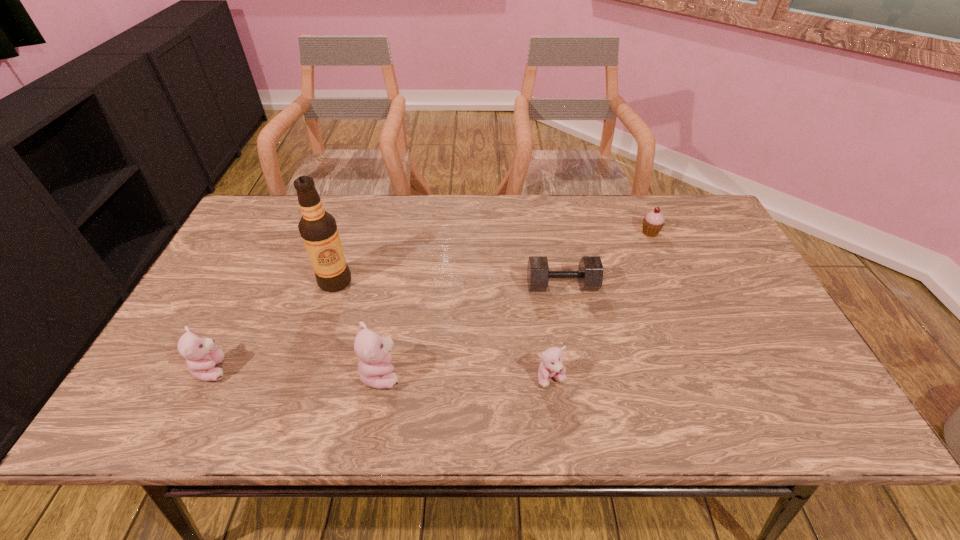
Identify the location of vacant area that lies between the dumbbell and the leftmost teddy bear. (388, 327).

Find the location of `free point between the leftmost teddy bear and the rightmost object`. free point between the leftmost teddy bear and the rightmost object is located at coordinates (432, 301).

Where is `the fourth closest object to the alcohol`? Image resolution: width=960 pixels, height=540 pixels. the fourth closest object to the alcohol is located at coordinates (551, 366).

Locate which object ranks fourth in proximity to the farthest object. Please provide its 2D coordinates. Your answer should be formatted as a tuple, i.e. [(x, y)], where the tuple contains the x and y coordinates of a point satisfying the conditions above.

[(318, 229)]

Identify which teddy bear is the third nearest to the cupcake. Please provide its 2D coordinates. Your answer should be formatted as a tuple, i.e. [(x, y)], where the tuple contains the x and y coordinates of a point satisfying the conditions above.

[(201, 354)]

You are a GUI agent. You are given a task and a screenshot of the screen. Output one action in this format:
    pyautogui.click(x=<x>, y=<y>)
    Task: Click on the teddy bear that is the second nearest to the leftmost teddy bear
    Image resolution: width=960 pixels, height=540 pixels.
    Given the screenshot: What is the action you would take?
    pyautogui.click(x=551, y=366)